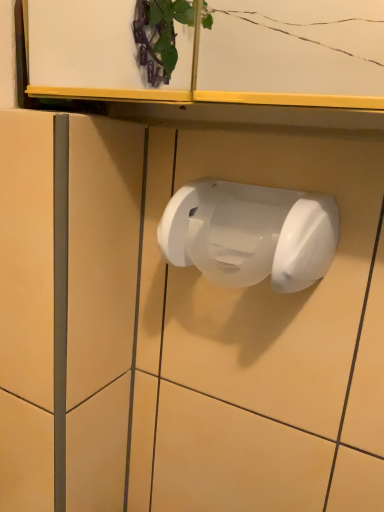
Measure the distance between white glossy toilet paper at center and camera.

Result: They are 38.53 centimeters apart.

What is the approximate width of white glossy toilet paper at center?

It is 12.29 centimeters.

Find the location of a particular element. The image size is (384, 512). white glossy toilet paper at center is located at coordinates (250, 234).

The width and height of the screenshot is (384, 512). What do you see at coordinates (250, 234) in the screenshot?
I see `white glossy toilet paper at center` at bounding box center [250, 234].

Identify the location of white glossy toilet paper at center. (250, 234).